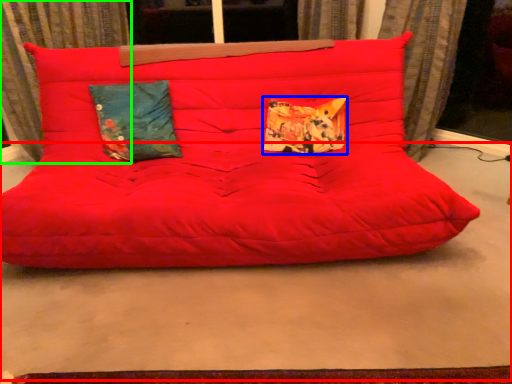
Question: Considering the real-world distances, which object is closest to concrete (highlighted by a red box)? pillow (highlighted by a blue box) or curtain (highlighted by a green box).

Choices:
 (A) pillow
 (B) curtain

Answer: (A)